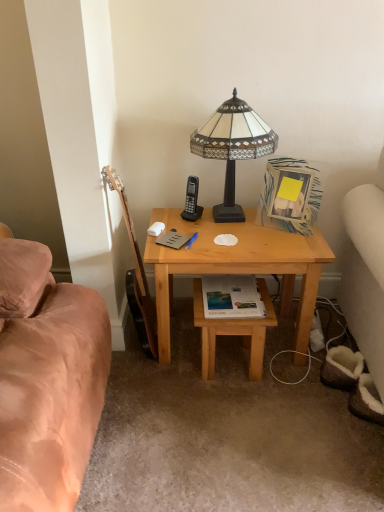
The width and height of the screenshot is (384, 512). Find the location of `vacant area that is in front of black plastic phone at center`. vacant area that is in front of black plastic phone at center is located at coordinates (196, 231).